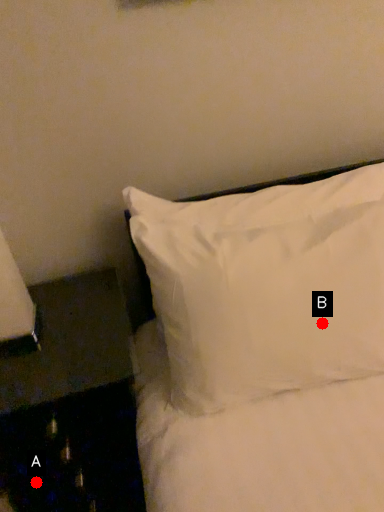
Question: Two points are circled on the image, labeled by A and B beside each circle. Which point appears farthest from the camera in this image?

Choices:
 (A) A is further
 (B) B is further

Answer: (A)